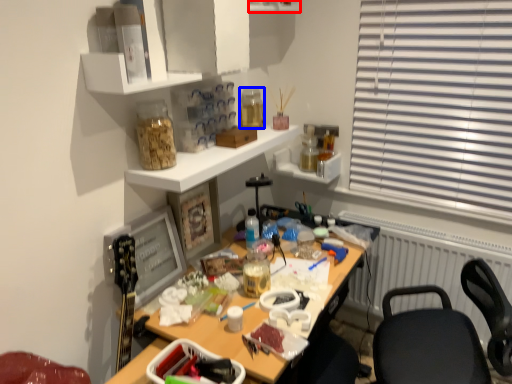
Question: Among these objects, which one is nearest to the camera, shelf (highlighted by a red box) or bottle (highlighted by a blue box)?

Choices:
 (A) shelf
 (B) bottle

Answer: (A)